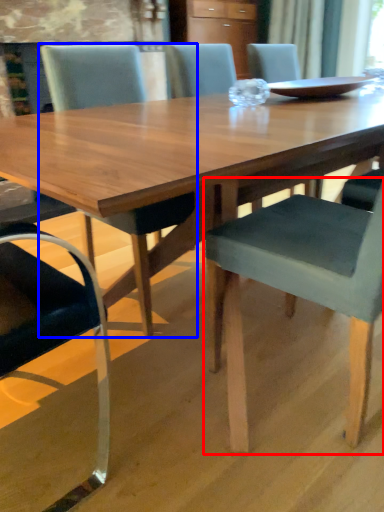
Question: Which object is further to the camera taking this photo, chair (highlighted by a red box) or chair (highlighted by a blue box)?

Choices:
 (A) chair
 (B) chair

Answer: (B)